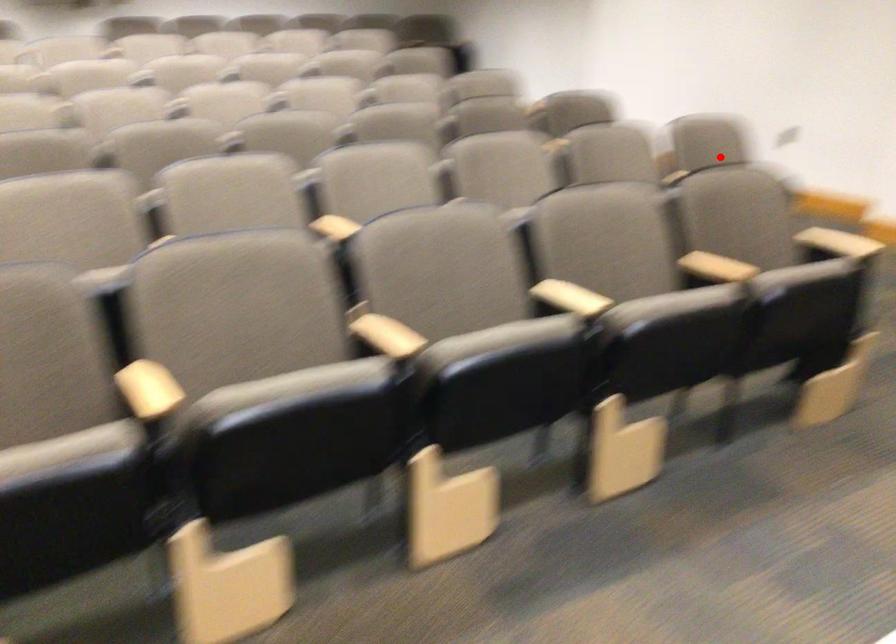
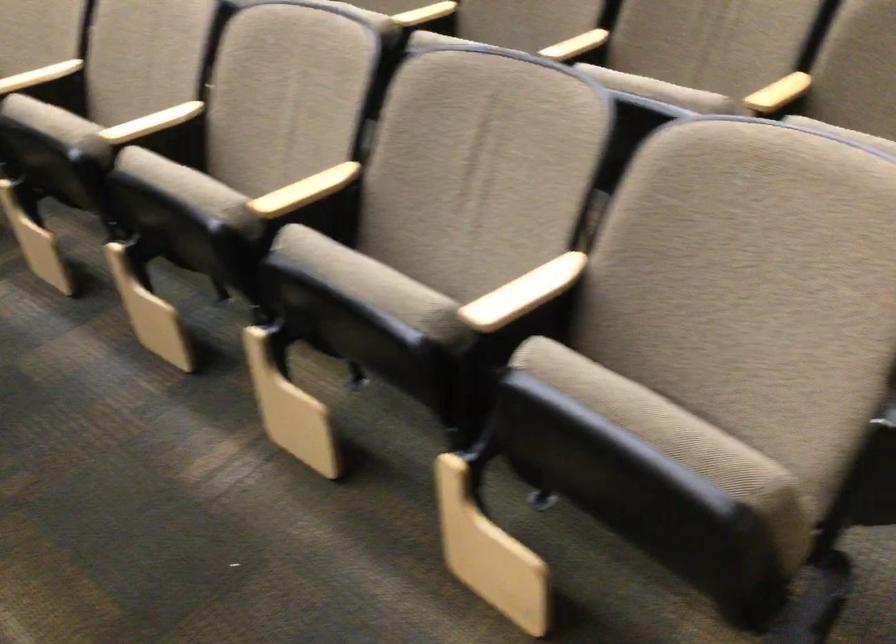
Question: I am providing you with two images of the same scene from different viewpoints. Image1 has a red point marked. In image2, the corresponding 3D location appears at what relative position? Reply with the corresponding letter.

Choices:
 (A) Closer
 (B) Farther

Answer: (A)